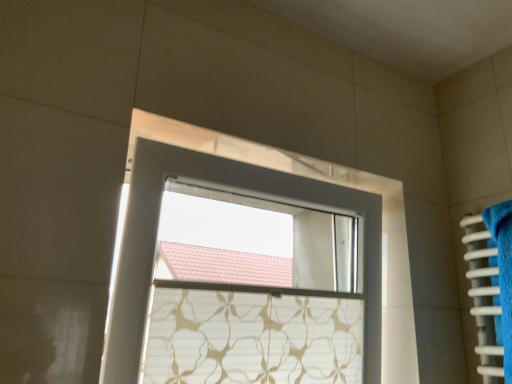
Based on the photo, measure the distance between transparent glass window at center and camera.

They are 83.57 centimeters apart.

What do you see at coordinates (227, 191) in the screenshot?
I see `transparent glass window at center` at bounding box center [227, 191].

The width and height of the screenshot is (512, 384). Find the location of `transparent glass window at center`. transparent glass window at center is located at coordinates point(227,191).

Find the location of a particular element. This screenshot has height=384, width=512. transparent glass window at center is located at coordinates (227, 191).